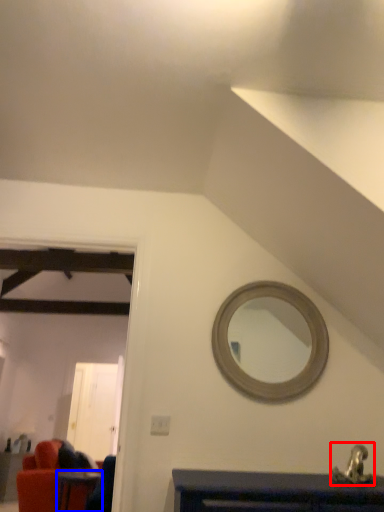
Question: Which point is closer to the camera, sink (highlighted by a red box) or table (highlighted by a blue box)?

Choices:
 (A) sink
 (B) table

Answer: (A)